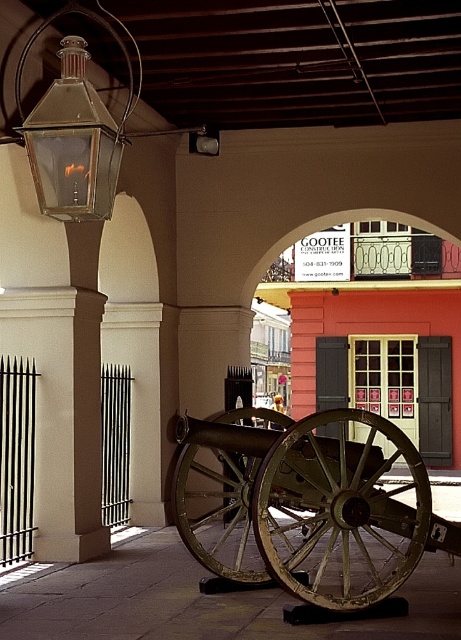
Does point (253, 436) come in front of point (205, 147)?

That is True.

Between point (353, 422) and point (211, 131), which one is positioned behind?

Positioned behind is point (353, 422).

Is point (340, 417) positioned after point (191, 138)?

No.

You are a GUI agent. You are given a task and a screenshot of the screen. Output one action in this format:
    pyautogui.click(x=<x>, y=<y>)
    Task: Click on the rusty metal cannon at center
    The image size is (461, 640).
    Given the screenshot: What is the action you would take?
    pyautogui.click(x=313, y=502)

Is matte glass lantern at upper left taller than metallic glass lantern at upper center?

Correct, matte glass lantern at upper left is much taller as metallic glass lantern at upper center.

Can you confirm if matte glass lantern at upper left is positioned to the right of metallic glass lantern at upper center?

In fact, matte glass lantern at upper left is to the left of metallic glass lantern at upper center.

This screenshot has width=461, height=640. Describe the element at coordinates (75, 131) in the screenshot. I see `matte glass lantern at upper left` at that location.

The height and width of the screenshot is (640, 461). I want to click on matte glass lantern at upper left, so click(75, 131).

Measure the distance between rusty metal cannon at center and camera.

6.27 meters

Does rusty metal cannon at center have a greater height compared to matte glass lantern at upper left?

Yes.

This screenshot has width=461, height=640. I want to click on rusty metal cannon at center, so click(x=313, y=502).